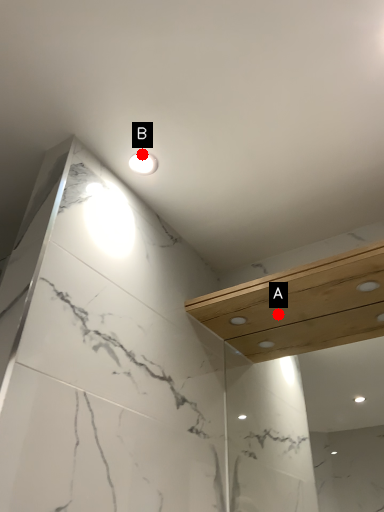
Question: Two points are circled on the image, labeled by A and B beside each circle. Among these points, which one is nearest to the camera?

Choices:
 (A) A is closer
 (B) B is closer

Answer: (B)